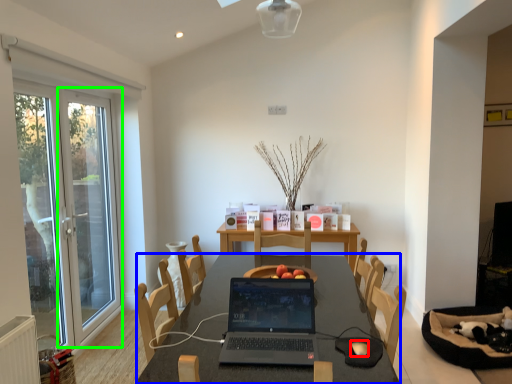
Question: Estimate the real-world distances between objects in this image. Which object is closer to mouse (highlighted by a red box), table (highlighted by a blue box) or screen door (highlighted by a green box)?

Choices:
 (A) table
 (B) screen door

Answer: (A)